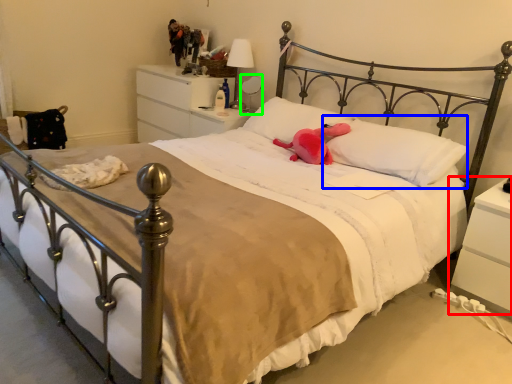
Question: Based on their relative distances, which object is farther from nightstand (highlighted by a red box)? Choose from pillow (highlighted by a blue box) and table lamp (highlighted by a green box).

Choices:
 (A) pillow
 (B) table lamp

Answer: (B)